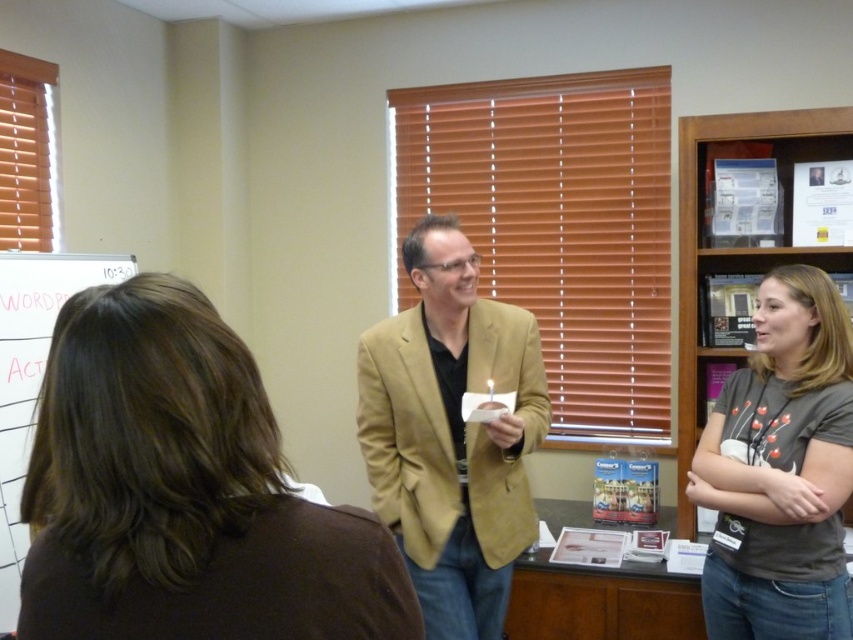
Question: Estimate the real-world distances between objects in this image. Which object is farther from the gray cotton t-shirt at center right?

Choices:
 (A) matte gold blazer at center
 (B) white grid paper at upper left
 (C) brown fabric hair at left

Answer: (B)

Question: Is brown fabric hair at left to the left of white grid paper at upper left from the viewer's perspective?

Choices:
 (A) yes
 (B) no

Answer: (B)

Question: Which object is closer to the camera taking this photo?

Choices:
 (A) white grid paper at upper left
 (B) gray cotton t-shirt at center right

Answer: (B)

Question: Which object is farther from the camera taking this photo?

Choices:
 (A) gray cotton t-shirt at center right
 (B) brown fabric hair at left
 (C) matte gold blazer at center

Answer: (C)

Question: Is brown fabric hair at left positioned before gray cotton t-shirt at center right?

Choices:
 (A) yes
 (B) no

Answer: (A)

Question: Is brown fabric hair at left positioned before gray cotton t-shirt at center right?

Choices:
 (A) no
 (B) yes

Answer: (B)